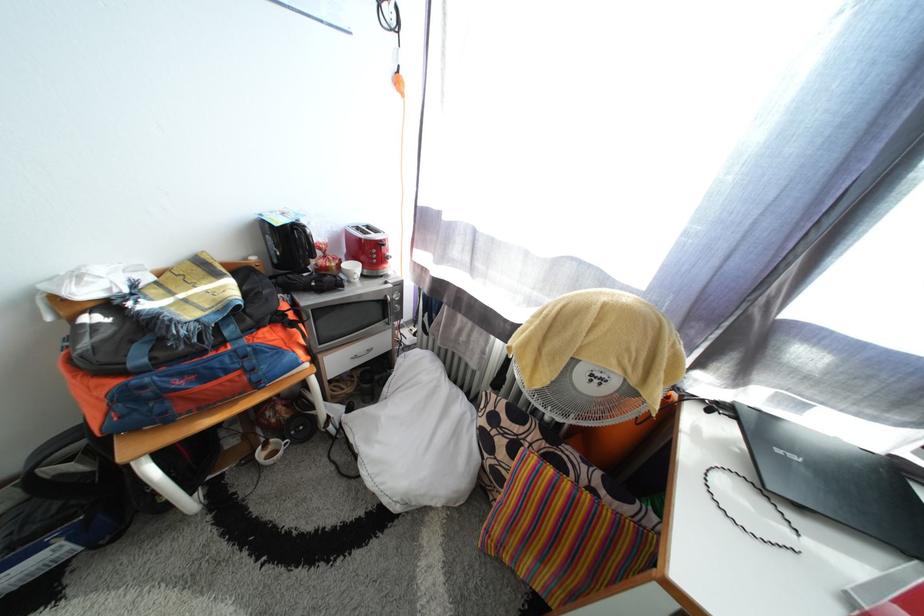
Locate an element on the screen. This screenshot has height=616, width=924. black laptop is located at coordinates (833, 479).